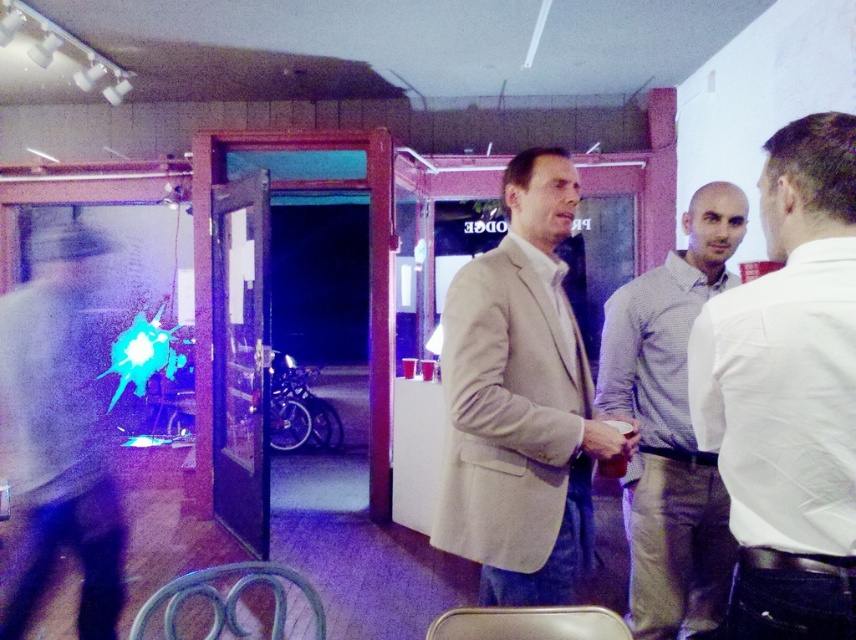
I want to click on white shirt at center, so click(x=788, y=394).

This screenshot has height=640, width=856. I want to click on white shirt at center, so click(788, 394).

Locate an element on the screen. light beige suit at center is located at coordinates point(521,401).

Between point (621, 452) and point (646, 589), which one is positioned behind?

The point (646, 589) is more distant.

Which is behind, point (512, 314) or point (658, 456)?

The point (658, 456) is more distant.

In order to click on light beige suit at center in this screenshot , I will do coord(521,401).

Is white shirt at center closer to camera compared to matte black jacket at left?

Yes.

From the picture: Can you confirm if white shirt at center is positioned to the left of matte black jacket at left?

No, white shirt at center is not to the left of matte black jacket at left.

Is point (715, 339) positioned in front of point (43, 380)?

Yes, point (715, 339) is closer to viewer.

At what (x,y) coordinates should I click in order to perform the action: click on white shirt at center. Please return your answer as a coordinate pair (x, y). This screenshot has width=856, height=640. Looking at the image, I should click on (788, 394).